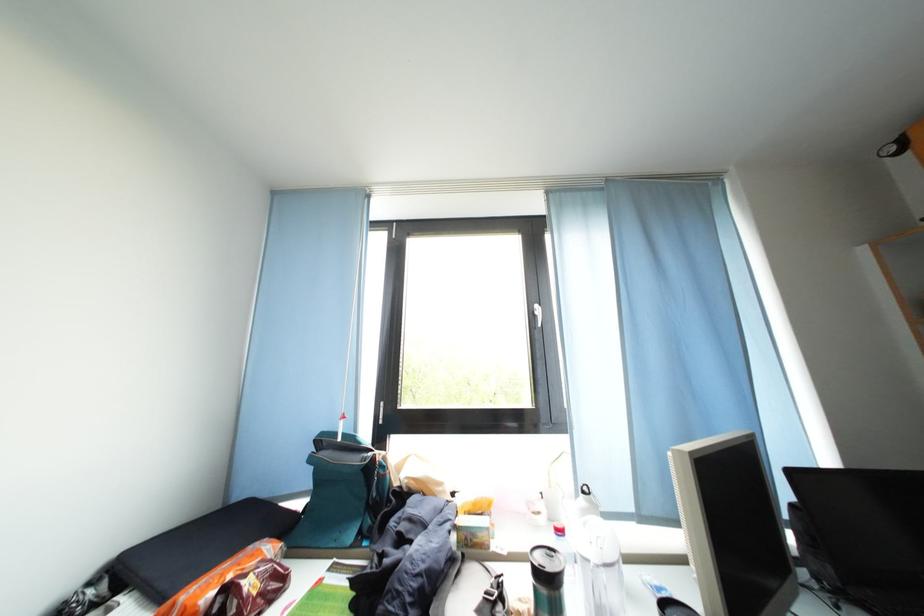
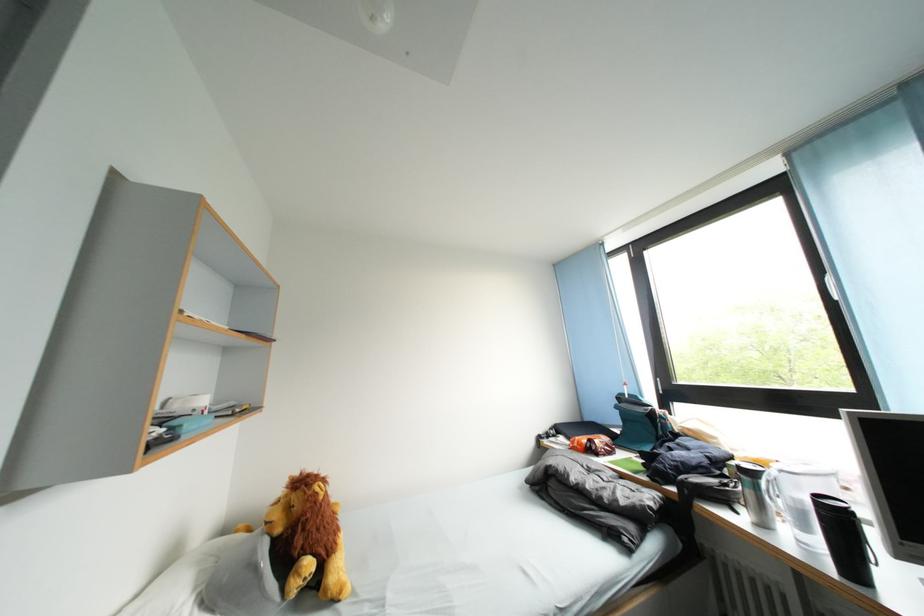
Locate, in the second image, the point that corresponds to [351,422] in the first image.

(634, 389)